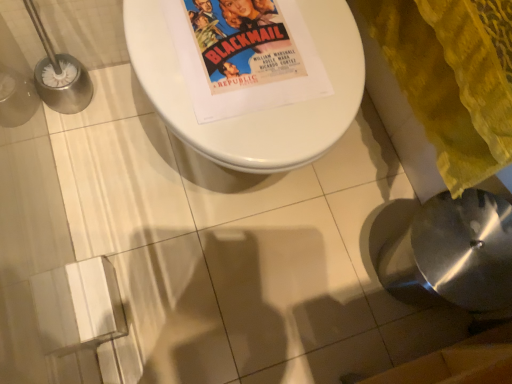
The image size is (512, 384). Find the location of `unoccupied region to the right of satin silver sink at lower right`. unoccupied region to the right of satin silver sink at lower right is located at coordinates (425, 317).